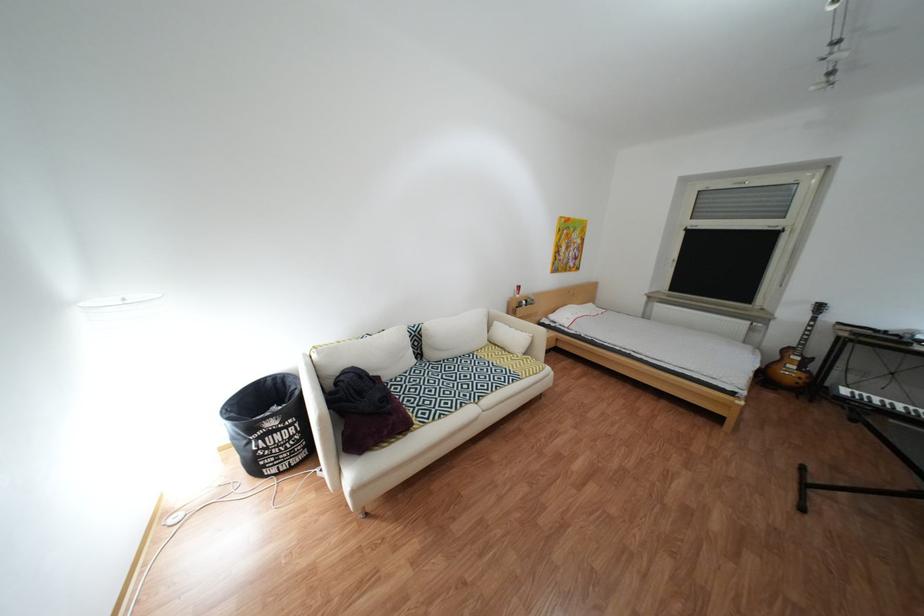
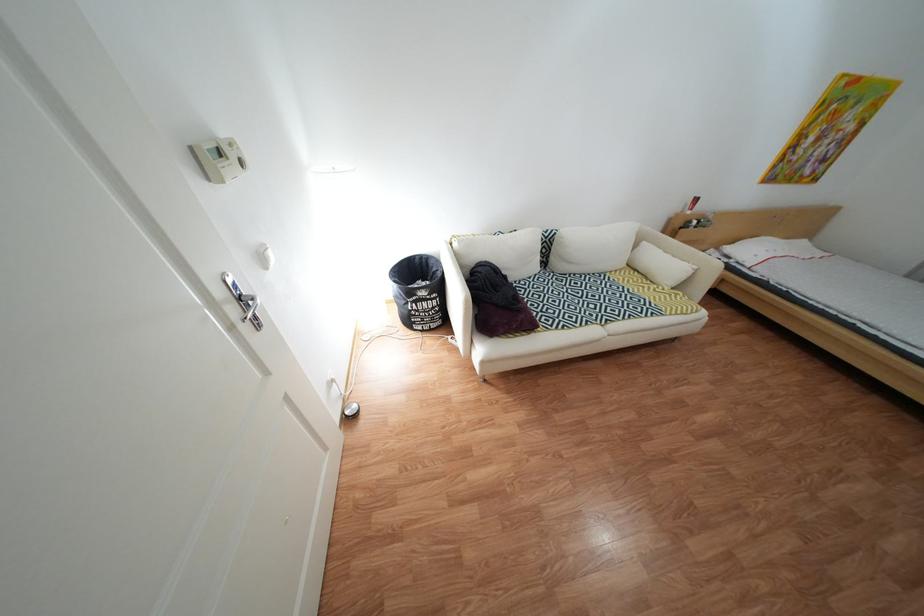
Locate, in the second image, the point that corresponds to point 568,317 in the first image.

(744, 249)